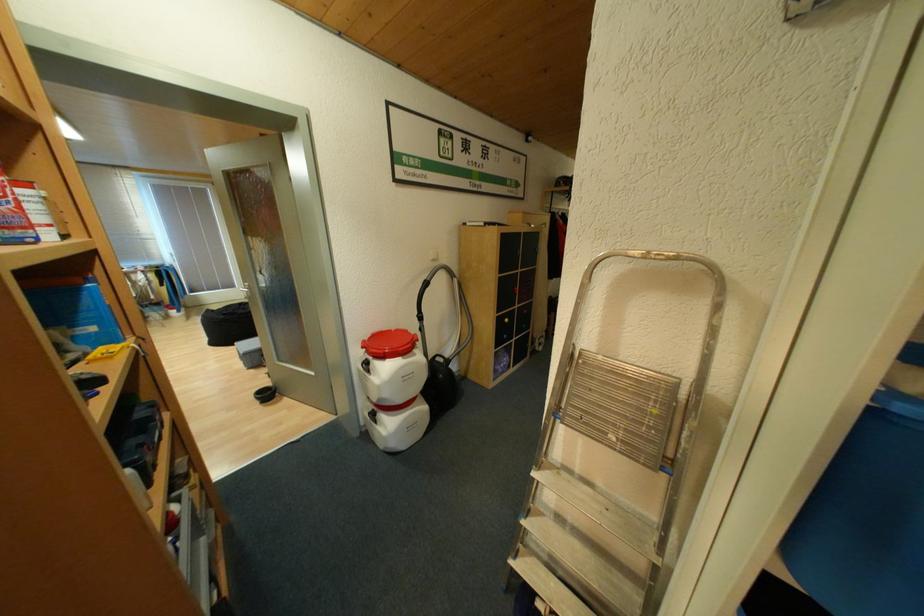
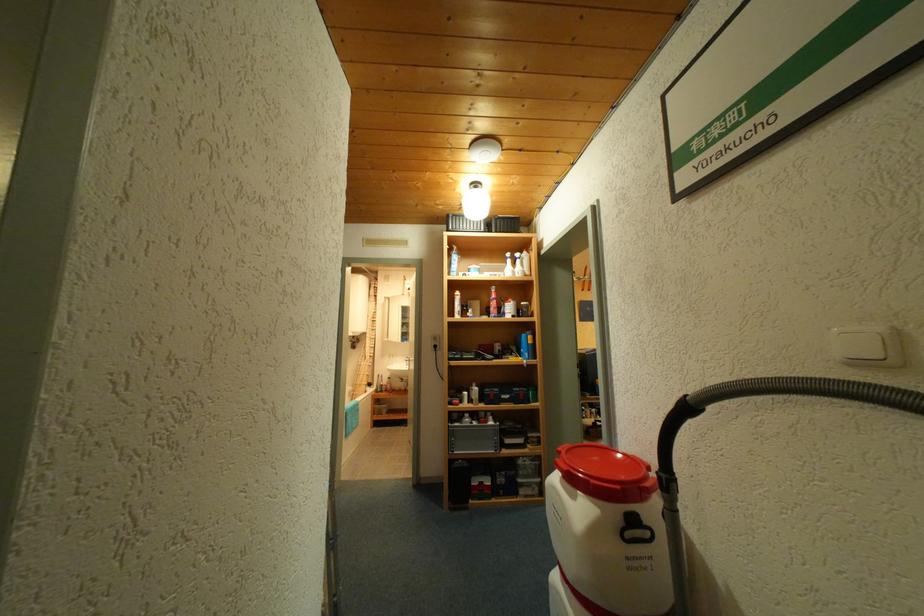
In the second image, find the point that corresponds to point 444,261 in the first image.

(868, 363)